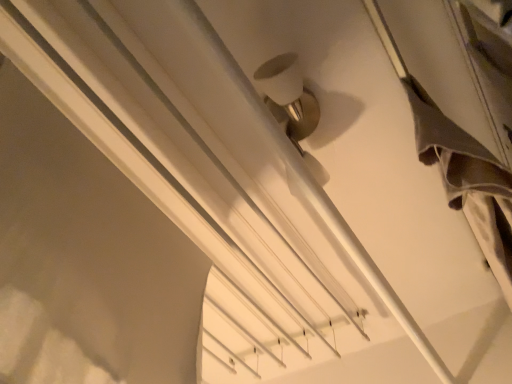
This screenshot has width=512, height=384. What do you see at coordinates (467, 180) in the screenshot? I see `dark gray fabric at right` at bounding box center [467, 180].

The image size is (512, 384). Find the location of `dark gray fabric at right`. dark gray fabric at right is located at coordinates (467, 180).

You are a GUI agent. You are given a task and a screenshot of the screen. Output one action in this format:
    pyautogui.click(x=<x>, y=<y>)
    Task: Click on the dark gray fabric at right
    
    Given the screenshot: What is the action you would take?
    (467, 180)